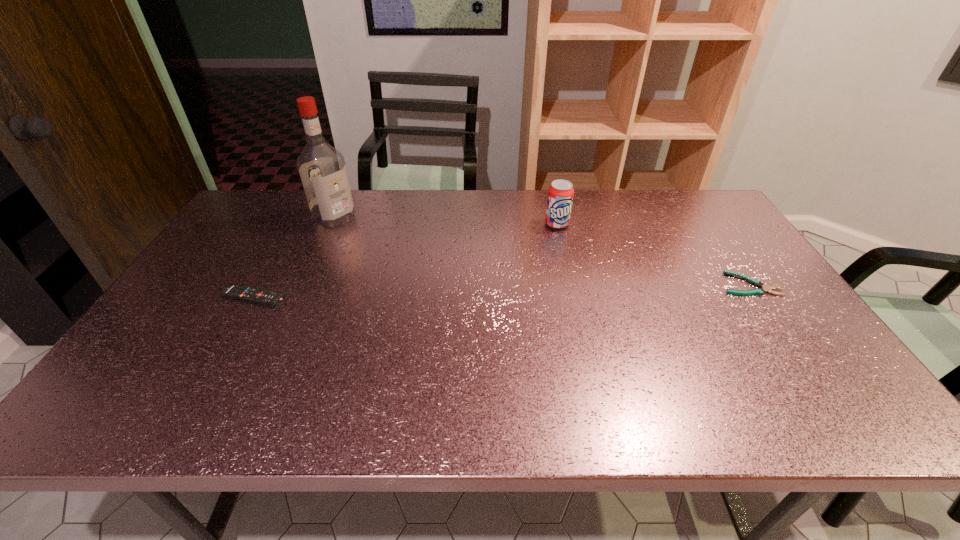
Identify the location of free location located 0.090m on the surface of the third object from left to right. (562, 248).

Where is `vacant area located on the front-facing side of the liquor`? This screenshot has height=540, width=960. vacant area located on the front-facing side of the liquor is located at coordinates coord(372,242).

Image resolution: width=960 pixels, height=540 pixels. In order to click on vacant position located on the front-facing side of the liquor in this screenshot , I will do `click(409, 267)`.

Image resolution: width=960 pixels, height=540 pixels. I want to click on vacant space located on the front-facing side of the liquor, so click(x=372, y=242).

Image resolution: width=960 pixels, height=540 pixels. Identify the location of soda can present at the far edge. (560, 194).

Find the location of a particular element. The image size is (960, 540). liquor situated at the far edge is located at coordinates (322, 169).

Identify the location of object located in the left edge section of the desktop. Image resolution: width=960 pixels, height=540 pixels. (240, 292).

Where is `object positioned at the right edge`? This screenshot has width=960, height=540. object positioned at the right edge is located at coordinates (759, 291).

Find the location of `vacant region at the far edge of the desktop`. vacant region at the far edge of the desktop is located at coordinates (416, 191).

I want to click on vacant area at the near edge of the desktop, so click(559, 365).